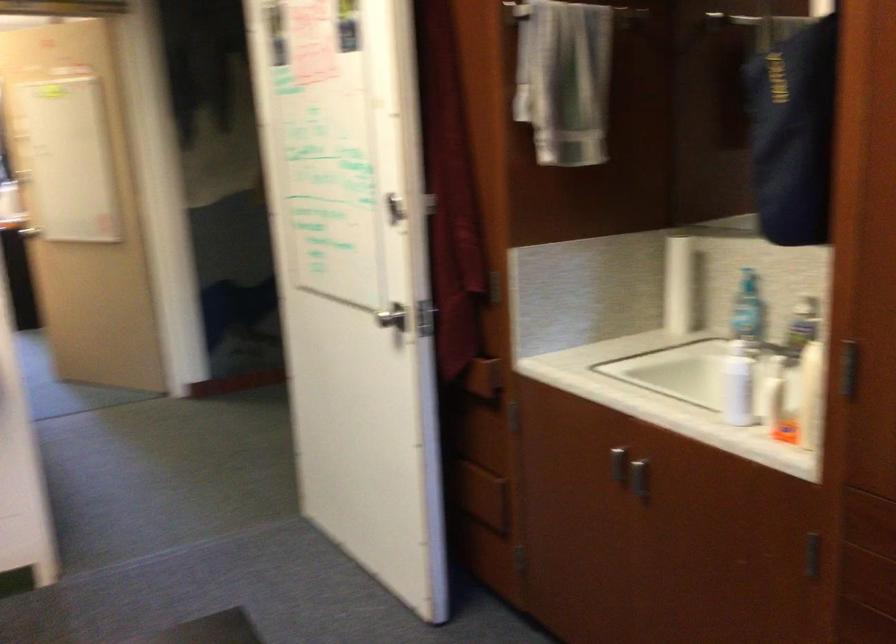
The width and height of the screenshot is (896, 644). What do you see at coordinates (747, 279) in the screenshot? I see `a blue soap pump` at bounding box center [747, 279].